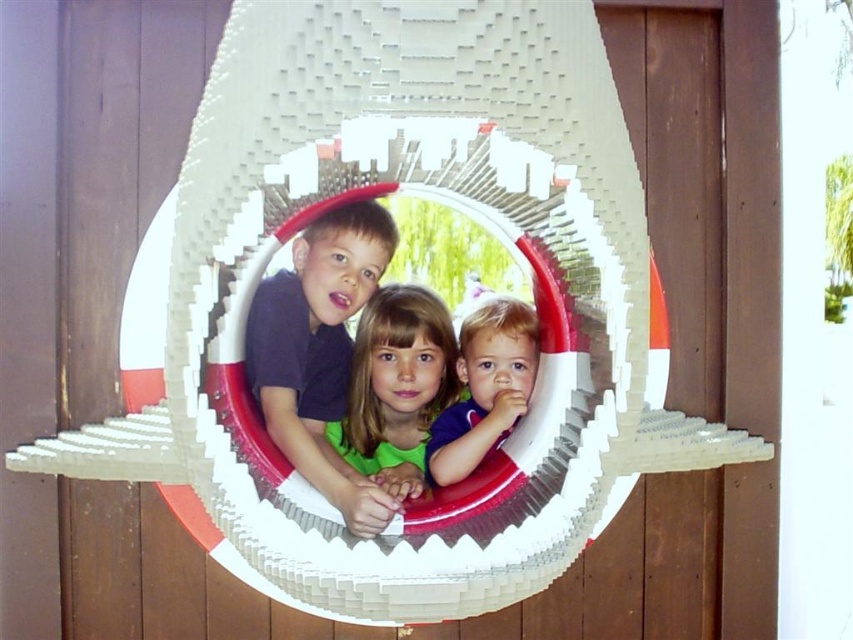
Is matte black shirt at center thinner than smooth green shirt at center?

In fact, matte black shirt at center might be wider than smooth green shirt at center.

Does matte black shirt at center appear under smooth green shirt at center?

No, matte black shirt at center is not below smooth green shirt at center.

Is point (299, 356) positioned behind point (409, 372)?

No.

Locate an element on the screen. This screenshot has width=853, height=640. matte black shirt at center is located at coordinates (318, 352).

Can you confirm if matte black shirt at center is shorter than smooth purple shirt at center?

Incorrect, matte black shirt at center's height does not fall short of smooth purple shirt at center's.

Does matte black shirt at center have a greater width compared to smooth purple shirt at center?

Yes.

In order to click on matte black shirt at center in this screenshot , I will do `click(318, 352)`.

Which is more to the right, smooth green shirt at center or smooth purple shirt at center?

smooth purple shirt at center is more to the right.

Who is more forward, (426, 353) or (473, 449)?

Point (473, 449) is in front.

Find the location of a particular element. smooth green shirt at center is located at coordinates (396, 387).